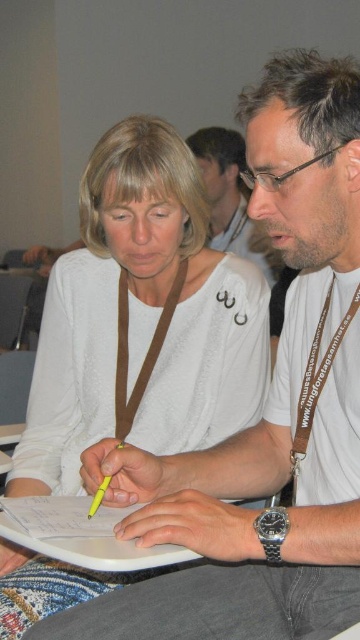
Question: Is white matte shirt at upper left thinner than matte white shirt at center?

Choices:
 (A) yes
 (B) no

Answer: (B)

Question: Can you confirm if white matte shirt at upper left is positioned above matte white shirt at center?

Choices:
 (A) no
 (B) yes

Answer: (A)

Question: Among these points, which one is farthest from the camera?

Choices:
 (A) (59, 451)
 (B) (226, 243)

Answer: (B)

Question: Which of the following is the closest to the observer?

Choices:
 (A) matte white shirt at center
 (B) white matte shirt at upper left

Answer: (B)

Question: Can you confirm if white matte shirt at upper left is thinner than matte white shirt at center?

Choices:
 (A) yes
 (B) no

Answer: (B)